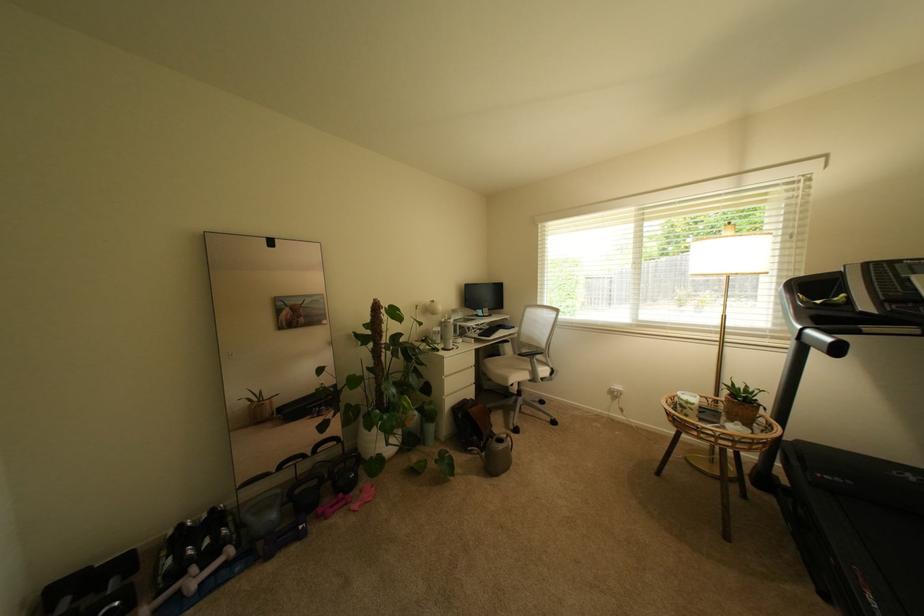
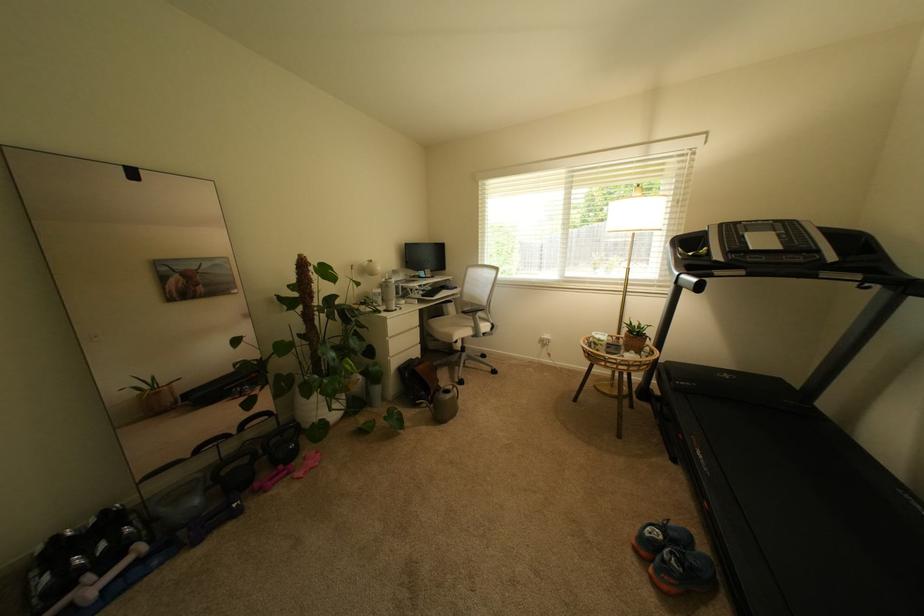
Question: Based on the continuous images, in which direction is the camera rotating? Reply with the corresponding letter.

Choices:
 (A) Left
 (B) Right
 (C) Up
 (D) Down

Answer: (B)